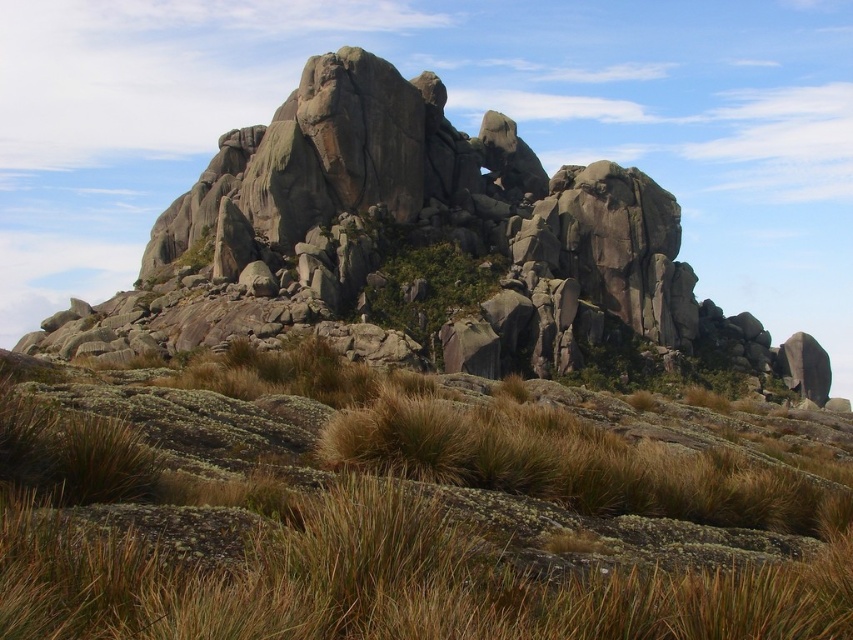
You are a hiker trying to cross this rocky landscape. You notice brown grassy at center and gray rough rock formation at center. Which path would be safer to walk on?

The gray rough rock formation at center is safer to walk on because it is thicker than the brown grassy at center, providing a more stable surface.

You are standing at the point marked as point [416,557] in the rugged rocky landscape. What type of terrain are you currently standing on?

The point [416,557] is on brown grassy at center, so you are standing on brown grassy terrain.

Looking at this image, you are a hiker navigating the rugged rocky landscape. You notice brown grassy at center and green leafy shrub at center. Which object is closer to the ground?

The brown grassy at center is positioned under the green leafy shrub at center, so it is closer to the ground.